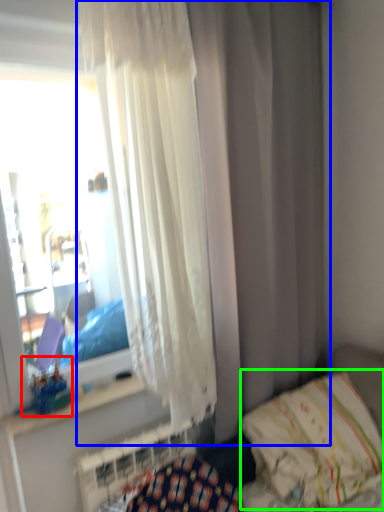
Question: Based on their relative distances, which object is nearer to toy (highlighted by a red box)? Choose from curtain (highlighted by a blue box) and pillow (highlighted by a green box).

Choices:
 (A) curtain
 (B) pillow

Answer: (B)